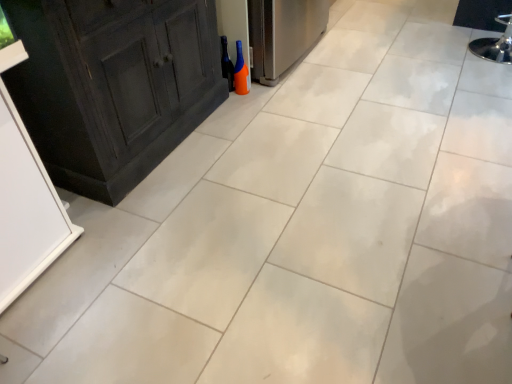
What do you see at coordinates (241, 73) in the screenshot? I see `orange matte bottle at center` at bounding box center [241, 73].

Locate an element on the screen. orange matte bottle at center is located at coordinates (241, 73).

What do you see at coordinates (227, 64) in the screenshot? I see `black glass wine bottle at center` at bounding box center [227, 64].

Where is `black glass wine bottle at center`? black glass wine bottle at center is located at coordinates (227, 64).

This screenshot has height=384, width=512. In order to click on orange matte bottle at center in this screenshot , I will do `click(241, 73)`.

Which is more to the right, black glass wine bottle at center or orange matte bottle at center?

orange matte bottle at center.

Considering the positions of objects black glass wine bottle at center and orange matte bottle at center in the image provided, who is behind, black glass wine bottle at center or orange matte bottle at center?

black glass wine bottle at center is further away from the camera.

Considering the positions of points (226, 72) and (243, 91), is point (226, 72) closer to camera compared to point (243, 91)?

Yes, point (226, 72) is closer to viewer.

From the image's perspective, is black glass wine bottle at center located above or below orange matte bottle at center?

black glass wine bottle at center is above orange matte bottle at center.

From a real-world perspective, between black glass wine bottle at center and orange matte bottle at center, who is vertically higher?

black glass wine bottle at center is physically above.

In terms of width, does black glass wine bottle at center look wider or thinner when compared to orange matte bottle at center?

black glass wine bottle at center is thinner than orange matte bottle at center.

Between black glass wine bottle at center and orange matte bottle at center, which one has less height?

Standing shorter between the two is orange matte bottle at center.

Based on the photo, can you confirm if black glass wine bottle at center is bigger than orange matte bottle at center?

Yes, black glass wine bottle at center is bigger than orange matte bottle at center.

Can we say black glass wine bottle at center lies outside orange matte bottle at center?

Yes, black glass wine bottle at center is located beyond the bounds of orange matte bottle at center.

Is black glass wine bottle at center touching orange matte bottle at center?

Yes, black glass wine bottle at center is right next to orange matte bottle at center and making contact.

Is black glass wine bottle at center oriented away from orange matte bottle at center?

Yes.

Locate an element on the screen. This screenshot has width=512, height=384. wine bottle lying above the orange matte bottle at center (from the image's perspective) is located at coordinates (227, 64).

Does orange matte bottle at center appear on the right side of black glass wine bottle at center?

Indeed, orange matte bottle at center is positioned on the right side of black glass wine bottle at center.

Is orange matte bottle at center closer to camera compared to black glass wine bottle at center?

Yes, orange matte bottle at center is in front of black glass wine bottle at center.

Is point (246, 84) positioned behind point (232, 85)?

Yes, it is behind point (232, 85).

From the image's perspective, is orange matte bottle at center above black glass wine bottle at center?

No.

From a real-world perspective, which is physically above, orange matte bottle at center or black glass wine bottle at center?

In real-world perspective, black glass wine bottle at center is above.

Looking at this image, which of these two, orange matte bottle at center or black glass wine bottle at center, is wider?

orange matte bottle at center is wider.

Between orange matte bottle at center and black glass wine bottle at center, which one has more height?

Standing taller between the two is black glass wine bottle at center.

Does orange matte bottle at center have a smaller size compared to black glass wine bottle at center?

Yes.

Is orange matte bottle at center positioned beyond the bounds of black glass wine bottle at center?

Yes.

Is orange matte bottle at center touching black glass wine bottle at center?

Yes, orange matte bottle at center is with black glass wine bottle at center.

Is orange matte bottle at center oriented towards black glass wine bottle at center?

Yes, orange matte bottle at center is oriented towards black glass wine bottle at center.

How many degrees apart are the facing directions of orange matte bottle at center and black glass wine bottle at center?

The angle between the facing direction of orange matte bottle at center and the facing direction of black glass wine bottle at center is 0.000146 degrees.

Measure the distance from orange matte bottle at center to black glass wine bottle at center.

2.06 inches.

I want to click on wine bottle above the orange matte bottle at center (from a real-world perspective), so click(x=227, y=64).

Identify the location of bottle that is on the right side of black glass wine bottle at center. Image resolution: width=512 pixels, height=384 pixels. (241, 73).

The height and width of the screenshot is (384, 512). Identify the location of bottle that appears in front of the black glass wine bottle at center. (241, 73).